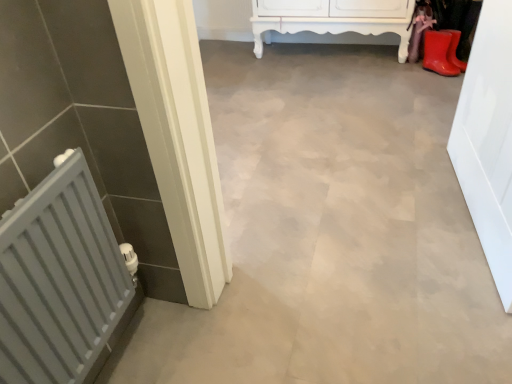
The height and width of the screenshot is (384, 512). I want to click on free spot behind white glossy door at right, so click(397, 144).